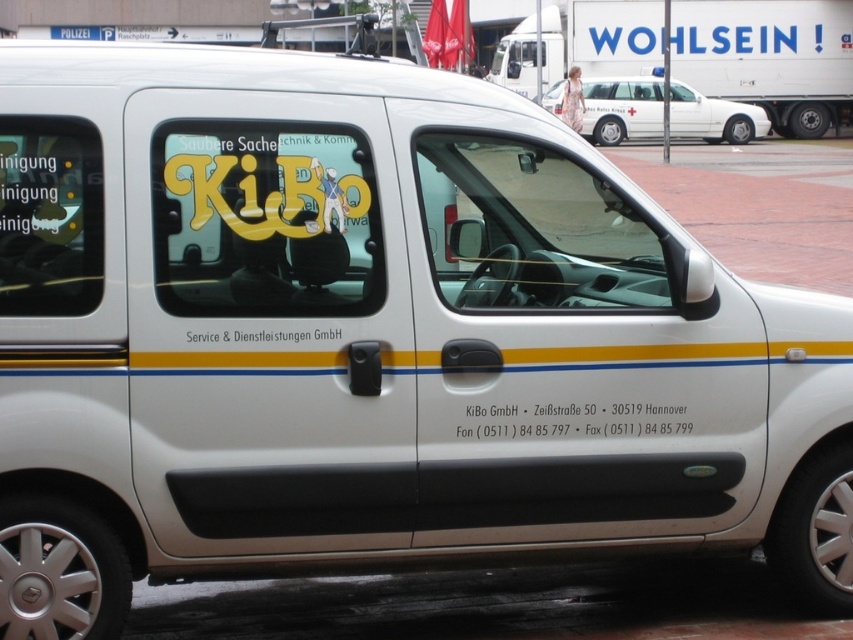
Who is taller, white matte text at lower center or white matte text at center?

Standing taller between the two is white matte text at lower center.

Between point (560, 410) and point (276, 339), which one is positioned behind?

Point (560, 410)

At what (x,y) coordinates should I click in order to perform the action: click on white matte text at lower center. Please return your answer as a coordinate pair (x, y). The width and height of the screenshot is (853, 640). Looking at the image, I should click on (573, 419).

Where is `white matte text at lower center`? The image size is (853, 640). white matte text at lower center is located at coordinates (573, 419).

Which is in front, point (669, 106) or point (306, 332)?

Positioned in front is point (306, 332).

Can you confirm if white glossy car at upper center is wider than white matte text at center?

Correct, the width of white glossy car at upper center exceeds that of white matte text at center.

Is point (604, 100) closer to viewer compared to point (310, 333)?

No, it is not.

Image resolution: width=853 pixels, height=640 pixels. Find the location of `white glossy car at upper center`. white glossy car at upper center is located at coordinates (622, 108).

Which of these two, white glossy ambulance at upper center or white matte text at center, stands shorter?

Standing shorter between the two is white matte text at center.

Is white glossy ambulance at upper center bigger than white matte text at center?

Indeed, white glossy ambulance at upper center has a larger size compared to white matte text at center.

Locate an element on the screen. The image size is (853, 640). white glossy ambulance at upper center is located at coordinates (769, 58).